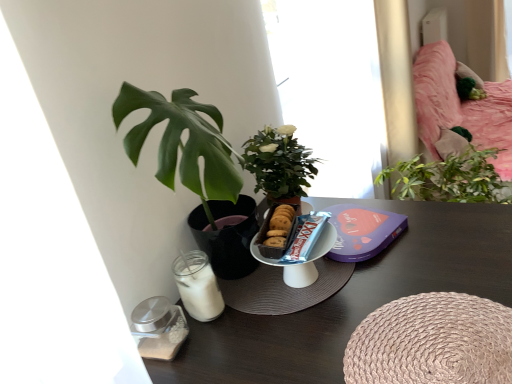
Question: Is transparent glass window at center completely or partially inside wooden table at lower left?

Choices:
 (A) no
 (B) yes

Answer: (A)

Question: Is the depth of wooden table at lower left less than that of transparent glass window at center?

Choices:
 (A) no
 (B) yes

Answer: (B)

Question: From a real-world perspective, is wooden table at lower left positioned over transparent glass window at center based on gravity?

Choices:
 (A) yes
 (B) no

Answer: (B)

Question: Does wooden table at lower left appear on the right side of transparent glass window at center?

Choices:
 (A) no
 (B) yes

Answer: (A)

Question: Can you confirm if wooden table at lower left is thinner than transparent glass window at center?

Choices:
 (A) yes
 (B) no

Answer: (B)

Question: Is point (415, 84) positioned closer to the camera than point (307, 74)?

Choices:
 (A) closer
 (B) farther

Answer: (B)

Question: In the image, is pink fabric bed at upper right positioned in front of or behind transparent glass window at center?

Choices:
 (A) behind
 (B) front

Answer: (A)

Question: Is pink fabric bed at upper right to the left or to the right of transparent glass window at center in the image?

Choices:
 (A) left
 (B) right

Answer: (B)

Question: Is pink fabric bed at upper right situated inside transparent glass window at center or outside?

Choices:
 (A) outside
 (B) inside

Answer: (A)

Question: In terms of size, does pink fabric bed at upper right appear bigger or smaller than wooden table at lower left?

Choices:
 (A) small
 (B) big

Answer: (B)

Question: In terms of width, does pink fabric bed at upper right look wider or thinner when compared to wooden table at lower left?

Choices:
 (A) wide
 (B) thin

Answer: (B)

Question: Is pink fabric bed at upper right taller or shorter than wooden table at lower left?

Choices:
 (A) tall
 (B) short

Answer: (A)

Question: Based on their positions, is pink fabric bed at upper right located to the left or right of wooden table at lower left?

Choices:
 (A) left
 (B) right

Answer: (B)

Question: Is pink fabric bed at upper right inside the boundaries of woven beige placemat at lower right, or outside?

Choices:
 (A) outside
 (B) inside

Answer: (A)

Question: Would you say pink fabric bed at upper right is to the left or to the right of woven beige placemat at lower right in the picture?

Choices:
 (A) right
 (B) left

Answer: (A)